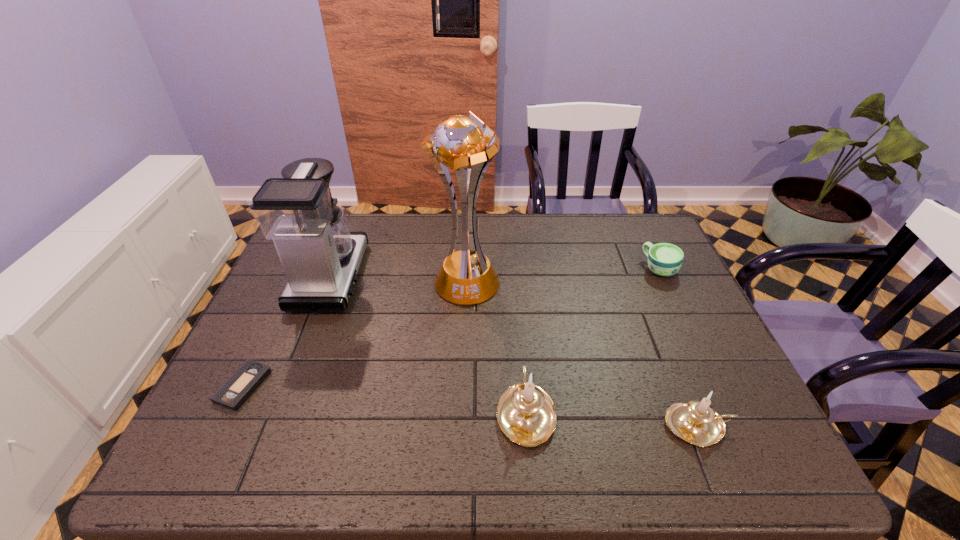
Locate an element on the screen. the taller candle holder is located at coordinates (525, 413).

I want to click on the third tallest object, so click(525, 413).

Identify the location of the right candle holder. Image resolution: width=960 pixels, height=540 pixels. (696, 422).

At what (x,y) coordinates should I click in order to perform the action: click on the shorter candle holder. Please return your answer as a coordinate pair (x, y). The image size is (960, 540). Looking at the image, I should click on (696, 422).

Where is `cup`? Image resolution: width=960 pixels, height=540 pixels. cup is located at coordinates (x=664, y=259).

Find the location of a particular element. This screenshot has width=960, height=540. the tallest object is located at coordinates (467, 277).

Locate an element on the screen. coffee maker is located at coordinates (320, 256).

Find the location of `the shortest object`. the shortest object is located at coordinates (234, 392).

This screenshot has width=960, height=540. In order to click on vacant point located on the handle side of the third tallest object in this screenshot , I will do `click(514, 274)`.

Find the location of `free space located 0.400m on the handle side of the third tallest object`. free space located 0.400m on the handle side of the third tallest object is located at coordinates (513, 268).